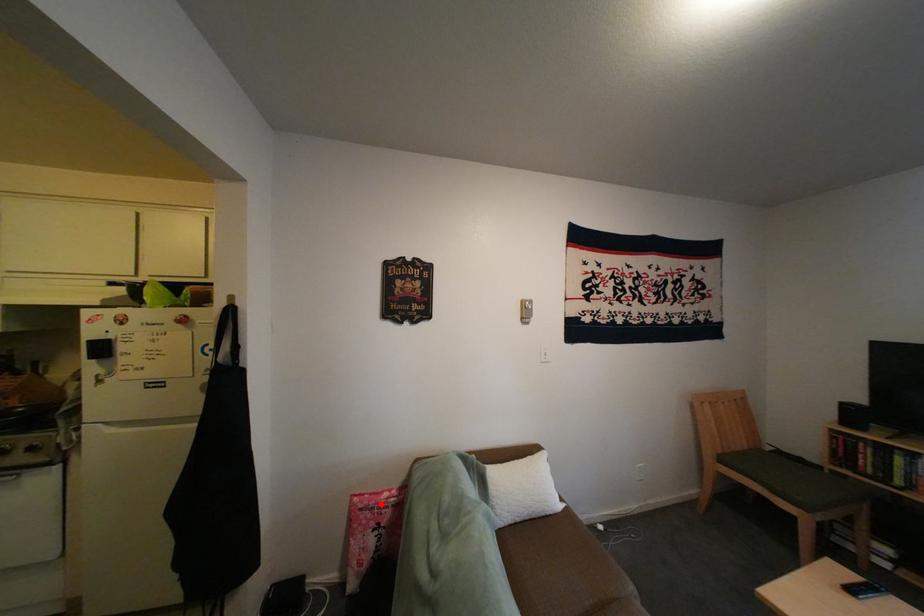
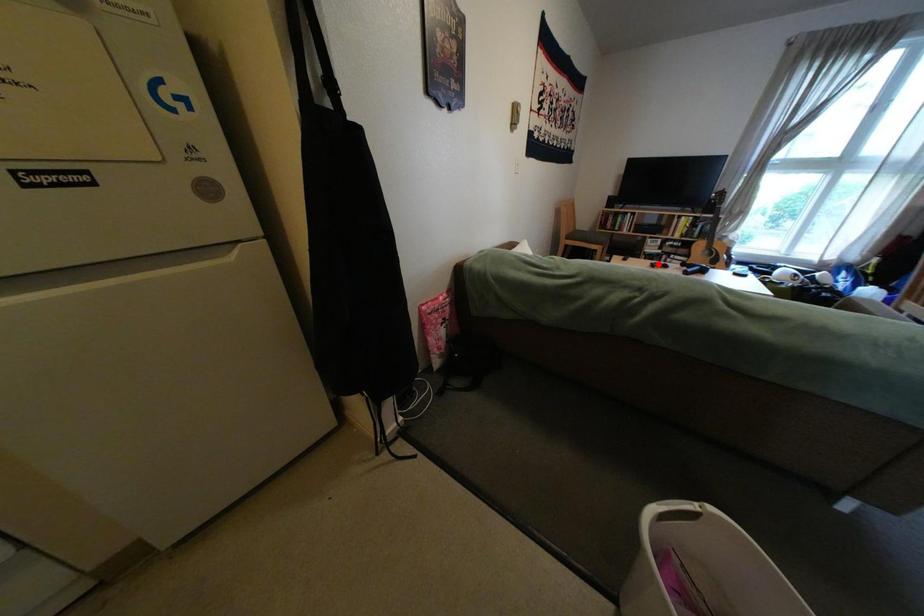
I am providing you with two images of the same scene from different viewpoints. A red point is marked on the first image and another point is marked on the second image. Is the marked point in image1 the same physical position as the marked point in image2?

No